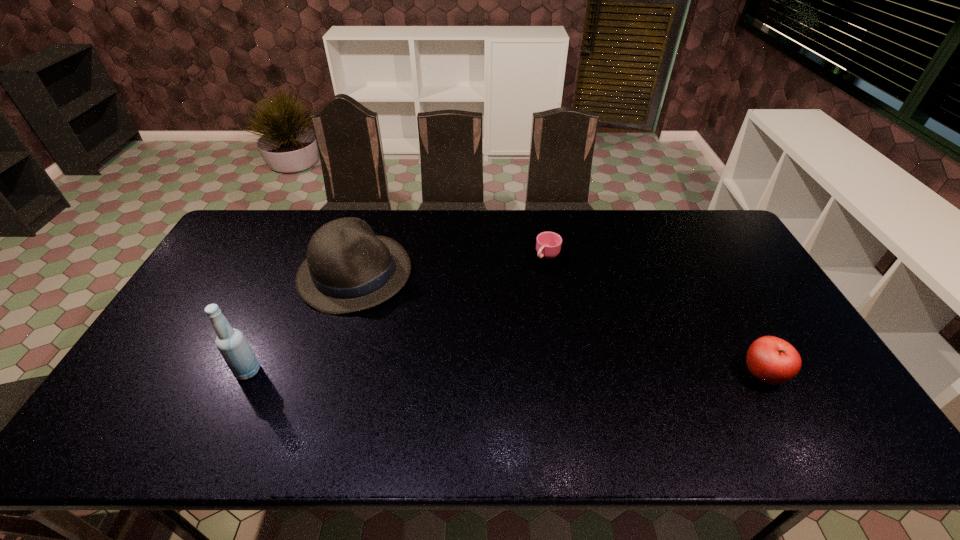
At what (x,y) coordinates should I click in order to perform the action: click on vacant space on the desktop that is between the tallest object and the third tallest object and is positioned on the front-facing side of the bowler hat. Please return your answer as a coordinate pair (x, y). Looking at the image, I should click on (515, 373).

This screenshot has width=960, height=540. In order to click on vacant space on the desktop that is between the tallest object and the apple and is positioned on the side with the handle of the shortest object in this screenshot , I will do `click(509, 373)`.